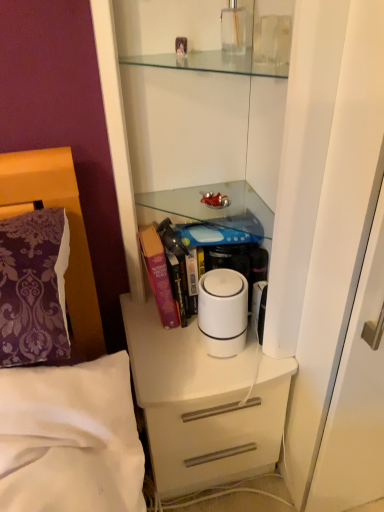
Question: Does white matte chest of drawers at center have a smaller size compared to white plastic humidifier at center?

Choices:
 (A) no
 (B) yes

Answer: (A)

Question: Is white matte chest of drawers at center at the right side of white plastic humidifier at center?

Choices:
 (A) yes
 (B) no

Answer: (B)

Question: Is white matte chest of drawers at center positioned behind white plastic humidifier at center?

Choices:
 (A) no
 (B) yes

Answer: (B)

Question: Does white matte chest of drawers at center come in front of white plastic humidifier at center?

Choices:
 (A) no
 (B) yes

Answer: (A)

Question: From the image's perspective, is white matte chest of drawers at center located beneath white plastic humidifier at center?

Choices:
 (A) no
 (B) yes

Answer: (B)

Question: Does white matte chest of drawers at center have a greater width compared to white plastic humidifier at center?

Choices:
 (A) no
 (B) yes

Answer: (B)

Question: Does white matte chest of drawers at center have a lesser width compared to purple hardcover book at center?

Choices:
 (A) yes
 (B) no

Answer: (B)

Question: Does white matte chest of drawers at center come in front of purple hardcover book at center?

Choices:
 (A) yes
 (B) no

Answer: (A)

Question: Does white matte chest of drawers at center have a lesser height compared to purple hardcover book at center?

Choices:
 (A) yes
 (B) no

Answer: (B)

Question: Is white matte chest of drawers at center smaller than purple hardcover book at center?

Choices:
 (A) yes
 (B) no

Answer: (B)

Question: Is white matte chest of drawers at center completely or partially outside of purple hardcover book at center?

Choices:
 (A) yes
 (B) no

Answer: (A)

Question: Is white matte chest of drawers at center further to the viewer compared to purple hardcover book at center?

Choices:
 (A) no
 (B) yes

Answer: (A)

Question: Is purple hardcover book at center next to white matte chest of drawers at center and touching it?

Choices:
 (A) yes
 (B) no

Answer: (B)